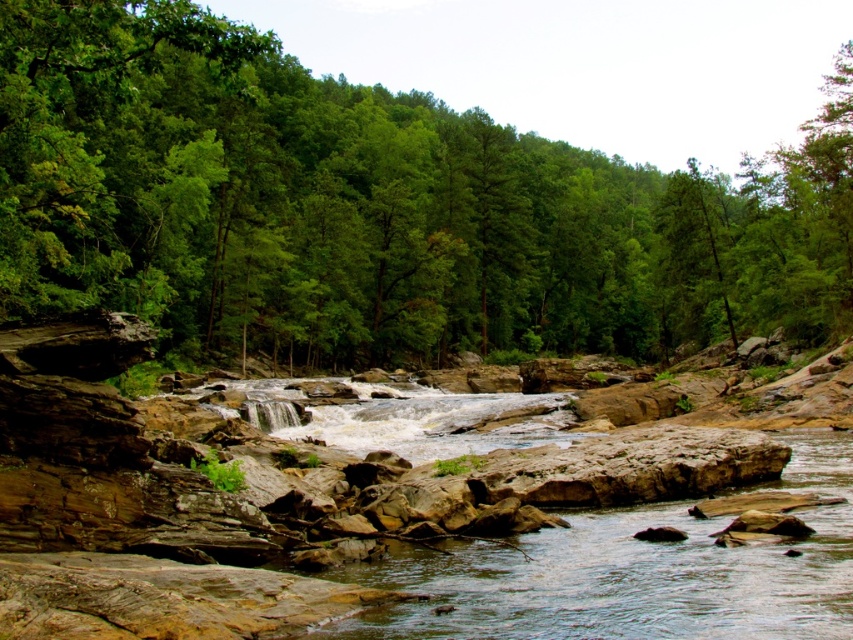
Question: Which point appears farthest from the camera in this image?

Choices:
 (A) (747, 284)
 (B) (836, 577)

Answer: (A)

Question: Where is green leafy tree at upper center located in relation to brown rocky river at center in the image?

Choices:
 (A) above
 (B) below

Answer: (A)

Question: Is green leafy tree at upper center wider than brown rocky river at center?

Choices:
 (A) no
 (B) yes

Answer: (B)

Question: Does green leafy tree at upper center appear on the left side of brown rocky river at center?

Choices:
 (A) no
 (B) yes

Answer: (A)

Question: Which point is closer to the camera?

Choices:
 (A) brown rocky river at center
 (B) green leafy tree at upper center

Answer: (A)